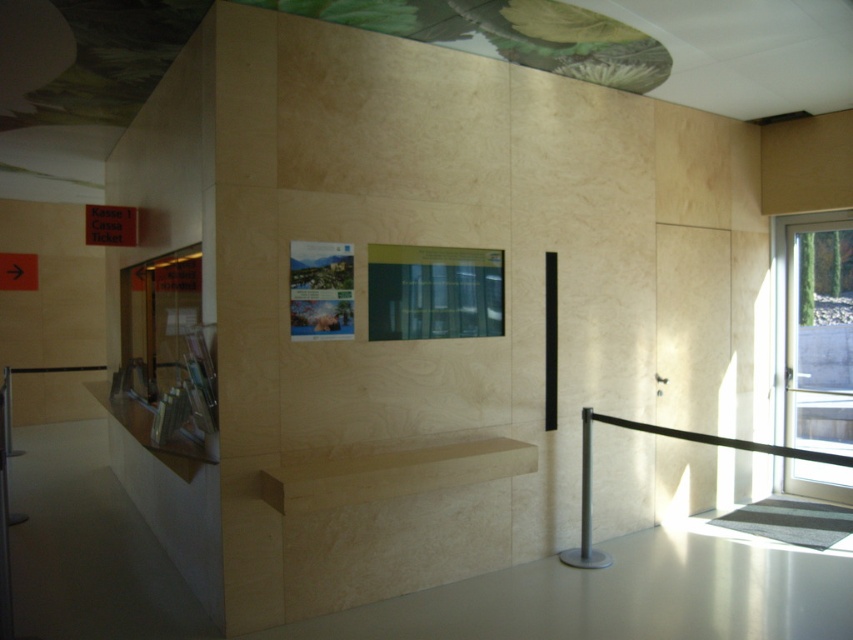
You are a visitor carrying a large backpack and need to place your items on a surface. Which object, the light wood shelf at center or the black rubber barrier at right, would be more suitable for placing your backpack?

The black rubber barrier at right is more suitable for placing your backpack because its width is greater than the light wood shelf at center.

You are standing at the entrance of the modern building and want to buy a ticket. There is a point marked at coordinates (257, 477) in the scene. If you walk straight towards the ticket counter, will you pass this point before reaching the counter?

The point at coordinates (257, 477) is 3.14 meters away from the viewer. Since the ticket counter is likely closer than that distance, you would not pass this point before reaching the counter.

You are standing in the modern building and need to locate the ticket office. The red sign with white text reading Kasse 1 is located above the counter area on the left. Where exactly is the point at coordinate [393,472] in relation to the ticket office counter?

The point at coordinate [393,472] is on the light wood shelf at center, which is not part of the ticket office counter on the left. The ticket office counter is on the left side of the image with the red Kasse 1 sign above it.